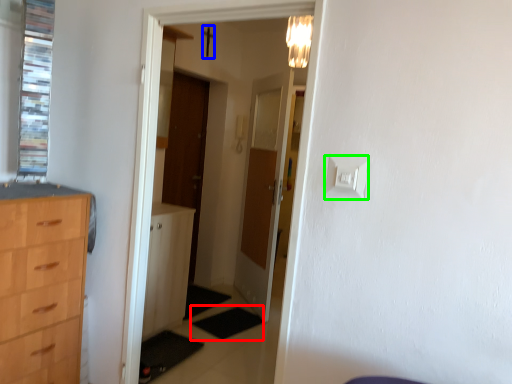
Question: Estimate the real-world distances between objects in this image. Which object is farther from mat (highlighted by a red box), crucifix (highlighted by a blue box) or light switch (highlighted by a green box)?

Choices:
 (A) crucifix
 (B) light switch

Answer: (A)